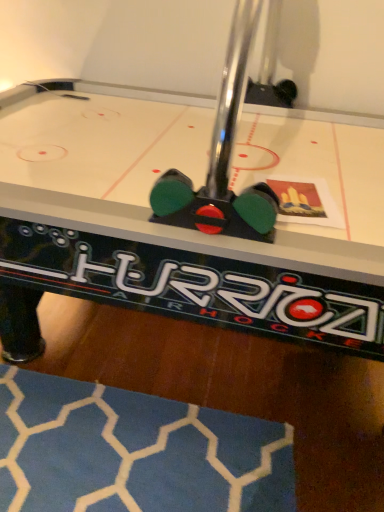
Question: From a real-world perspective, is white glossy air hockey table at center below blue fabric rug at lower left?

Choices:
 (A) no
 (B) yes

Answer: (A)

Question: Can blue fabric rug at lower left be found inside white glossy air hockey table at center?

Choices:
 (A) no
 (B) yes

Answer: (B)

Question: Is white glossy air hockey table at center taller than blue fabric rug at lower left?

Choices:
 (A) no
 (B) yes

Answer: (B)

Question: Considering the relative positions of white glossy air hockey table at center and blue fabric rug at lower left in the image provided, is white glossy air hockey table at center to the right of blue fabric rug at lower left from the viewer's perspective?

Choices:
 (A) yes
 (B) no

Answer: (A)

Question: Considering the relative positions of white glossy air hockey table at center and blue fabric rug at lower left in the image provided, is white glossy air hockey table at center to the left of blue fabric rug at lower left from the viewer's perspective?

Choices:
 (A) no
 (B) yes

Answer: (A)

Question: Is white glossy air hockey table at center thinner than blue fabric rug at lower left?

Choices:
 (A) no
 (B) yes

Answer: (A)

Question: Is blue fabric rug at lower left completely or partially outside of white glossy air hockey table at center?

Choices:
 (A) yes
 (B) no

Answer: (B)

Question: From the image's perspective, would you say blue fabric rug at lower left is shown under white glossy air hockey table at center?

Choices:
 (A) yes
 (B) no

Answer: (A)

Question: Could you tell me if blue fabric rug at lower left is facing white glossy air hockey table at center?

Choices:
 (A) no
 (B) yes

Answer: (B)

Question: From a real-world perspective, is blue fabric rug at lower left physically below white glossy air hockey table at center?

Choices:
 (A) no
 (B) yes

Answer: (B)

Question: Does blue fabric rug at lower left contain white glossy air hockey table at center?

Choices:
 (A) no
 (B) yes

Answer: (A)

Question: Does blue fabric rug at lower left have a smaller size compared to white glossy air hockey table at center?

Choices:
 (A) no
 (B) yes

Answer: (B)

Question: Would you say blue fabric rug at lower left is to the left or to the right of white glossy air hockey table at center in the picture?

Choices:
 (A) left
 (B) right

Answer: (A)